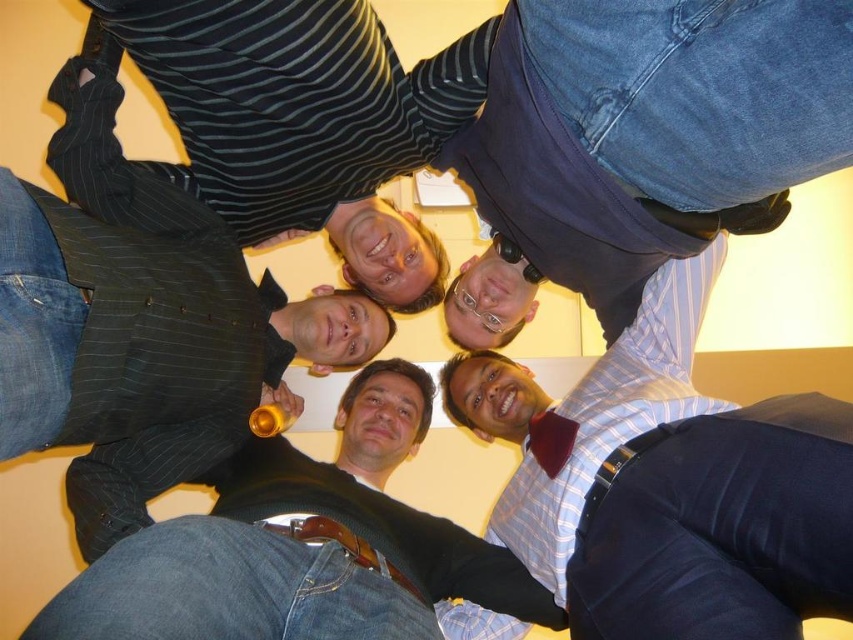
Can you confirm if striped fabric shirt at upper center is positioned to the left of blue striped shirt at center?

Yes, striped fabric shirt at upper center is to the left of blue striped shirt at center.

Between striped fabric shirt at upper center and blue striped shirt at center, which one has less height?

striped fabric shirt at upper center

The image size is (853, 640). Identify the location of striped fabric shirt at upper center. (306, 122).

Looking at this image, measure the distance between blue jeans at upper center and jeans at center.

The distance of blue jeans at upper center from jeans at center is 55.98 centimeters.

Which is more to the left, blue jeans at upper center or jeans at center?

From the viewer's perspective, jeans at center appears more on the left side.

Is point (595, 248) less distant than point (463, 580)?

That is True.

At what (x,y) coordinates should I click in order to perform the action: click on blue jeans at upper center. Please return your answer as a coordinate pair (x, y). The image size is (853, 640). Looking at the image, I should click on (648, 125).

Is blue jeans at upper center shorter than striped fabric shirt at upper center?

Correct, blue jeans at upper center is not as tall as striped fabric shirt at upper center.

Is blue jeans at upper center thinner than striped fabric shirt at upper center?

Yes, blue jeans at upper center is thinner than striped fabric shirt at upper center.

Is point (560, 225) positioned after point (283, 16)?

Yes, point (560, 225) is farther from viewer.

Image resolution: width=853 pixels, height=640 pixels. Find the location of `blue jeans at upper center`. blue jeans at upper center is located at coordinates (648, 125).